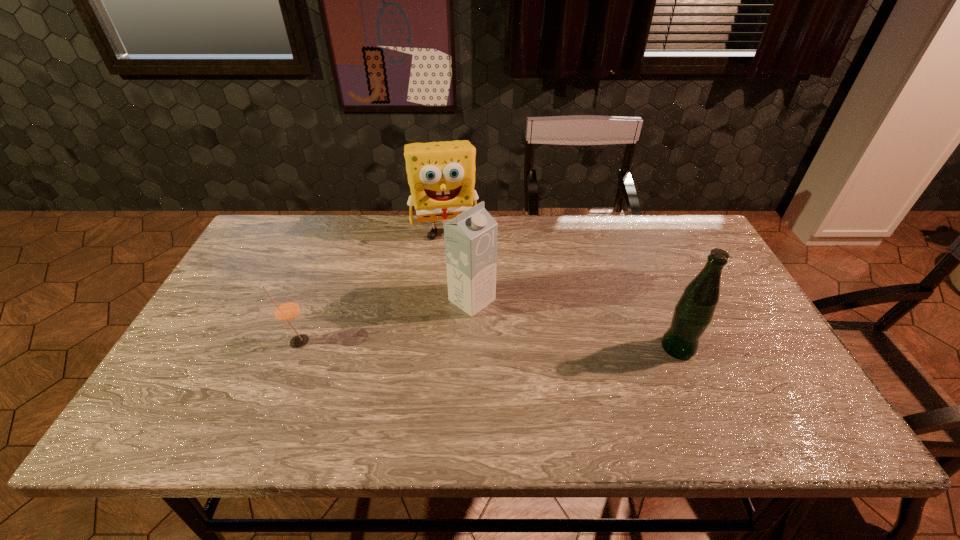
Locate an element on the screen. vacant space situated 0.210m on the face of the sponge is located at coordinates (458, 293).

Find the location of a particular element. This screenshot has height=540, width=960. free region located 0.190m on the face of the sponge is located at coordinates (457, 288).

Where is `free space located 0.110m on the face of the sponge`? free space located 0.110m on the face of the sponge is located at coordinates (453, 270).

Image resolution: width=960 pixels, height=540 pixels. Identify the location of object that is positioned at the far edge. (441, 175).

In the image, there is a desktop. In order to click on free region at the far edge in this screenshot , I will do `click(598, 235)`.

Where is `vacant point at the near edge`? This screenshot has height=540, width=960. vacant point at the near edge is located at coordinates (540, 380).

Identify the location of free space at the left edge. (227, 301).

This screenshot has height=540, width=960. Find the location of `vacant space at the far left corner of the desktop`. vacant space at the far left corner of the desktop is located at coordinates (299, 237).

I want to click on vacant region at the near left corner of the desktop, so click(x=204, y=384).

At what (x,y) coordinates should I click in order to perform the action: click on free space between the sponge and the straw. Please return your answer as a coordinate pair (x, y). Looking at the image, I should click on (372, 286).